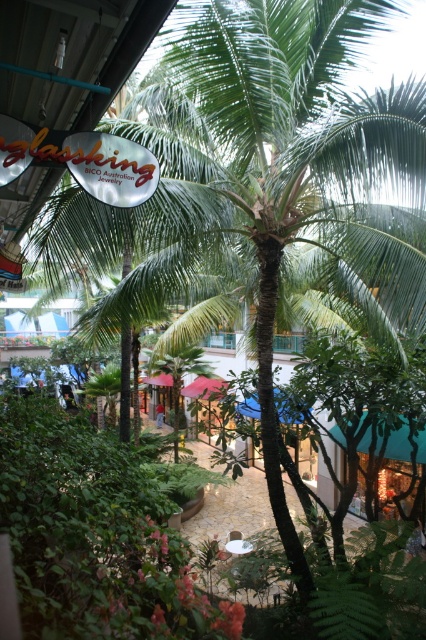
You are a customer looking for the entrance to the Glassking BICO Australian Jewelry store. You see a blue fabric canopy at lower left and a red fabric canopy at center. Which canopy is closer to you?

The blue fabric canopy at lower left is closer to you because the red fabric canopy at center is behind it.

You are a customer looking for shade while waiting in the outdoor shopping area. You see the blue fabric canopy at lower left and the red fabric canopy at center. Which canopy is positioned more to the left side of the area?

The blue fabric canopy at lower left is positioned more to the left side of the area than the red fabric canopy at center.

In the scene shown: You are navigating through the shopping area and need to reach the point marked as point (x=19, y=310). You are currently at point (x=170, y=376). Considering the dense tropical plants between them, which direction should you move to reach your destination?

Since point (x=19, y=310) is behind point (x=170, y=376), you should move backward to reach your destination while navigating around the dense tropical plants between them.